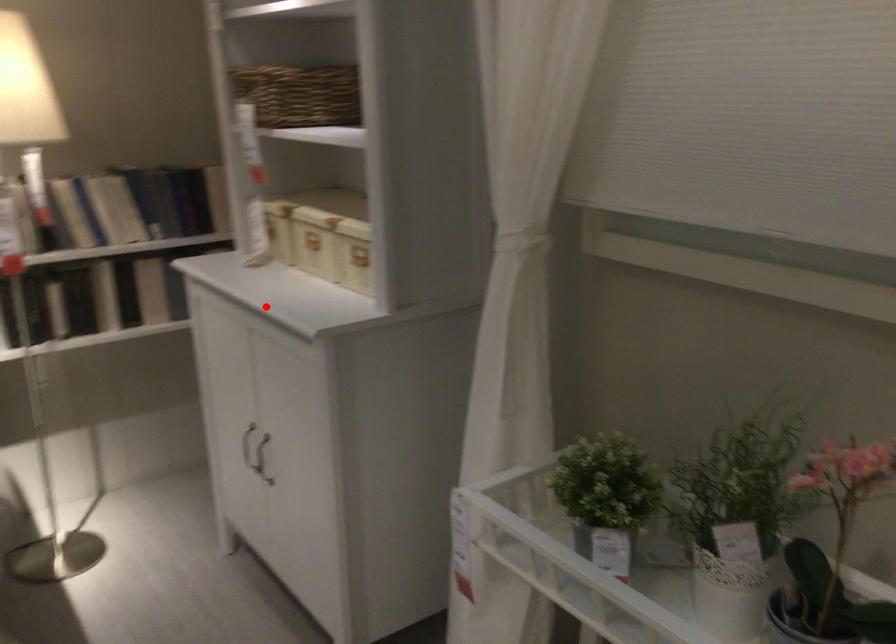
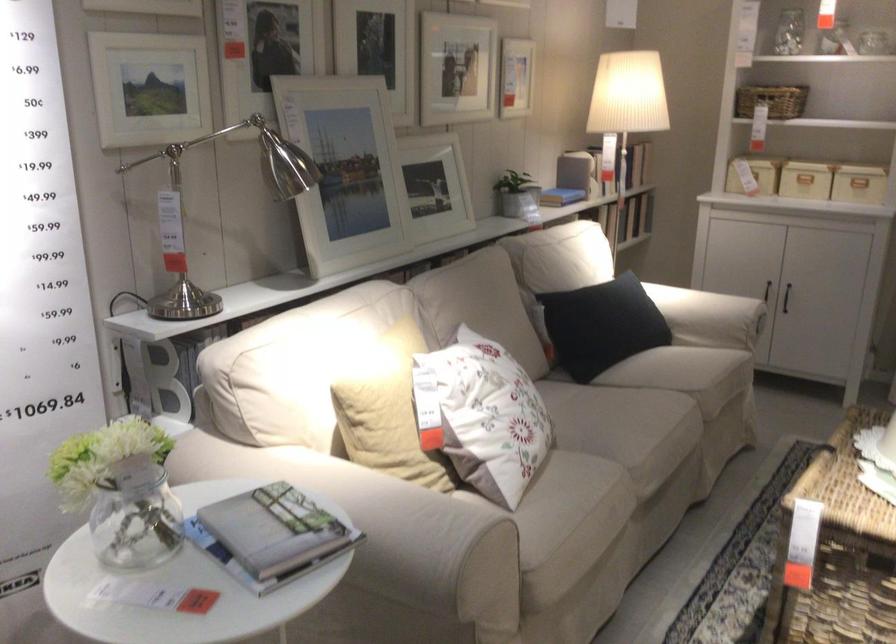
Where in the second image is the point corresponding to the highlighted location from the first image?

(858, 184)